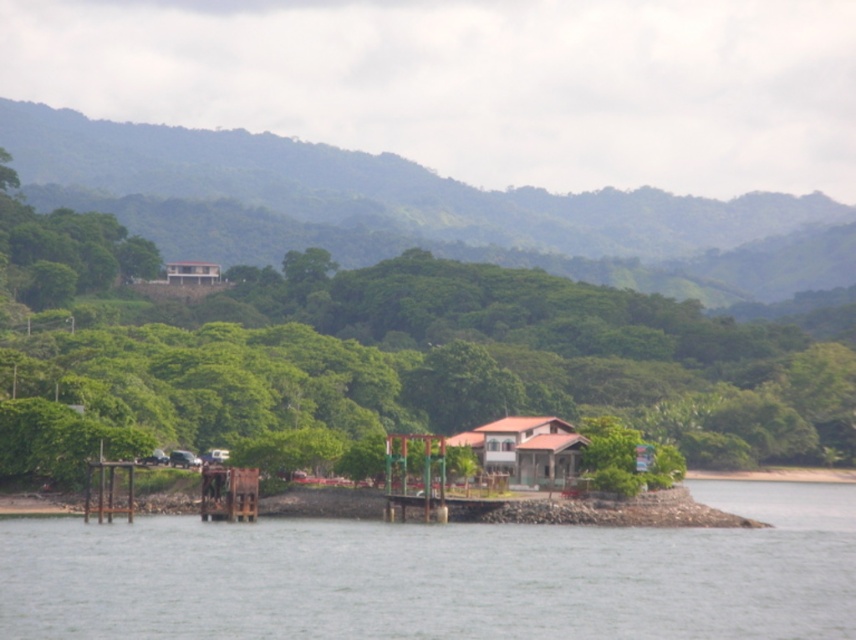
You are planning to build a garden shed between the green leafy tree at center and the brown wooden house at center. Considering their widths, which object should you place the shed closer to to ensure it fits better?

The green leafy tree at center is wider than the brown wooden house at center. Therefore, placing the shed closer to the brown wooden house at center would provide more space for the shed to fit better.

You are standing at point [94,355] and want to walk to point [544,444]. Which direction should you move to reach your destination?

To reach point [544,444] from point [94,355], you should move forward since the destination is in front of you.

You are a drone operator trying to capture a photo of the green leafy hillside at upper center. The drone is currently hovering at point (418, 211). Is the green leafy hillside at upper center directly below the drone?

The green leafy hillside at upper center is located at point (418, 211), so yes, the drone is directly above it.